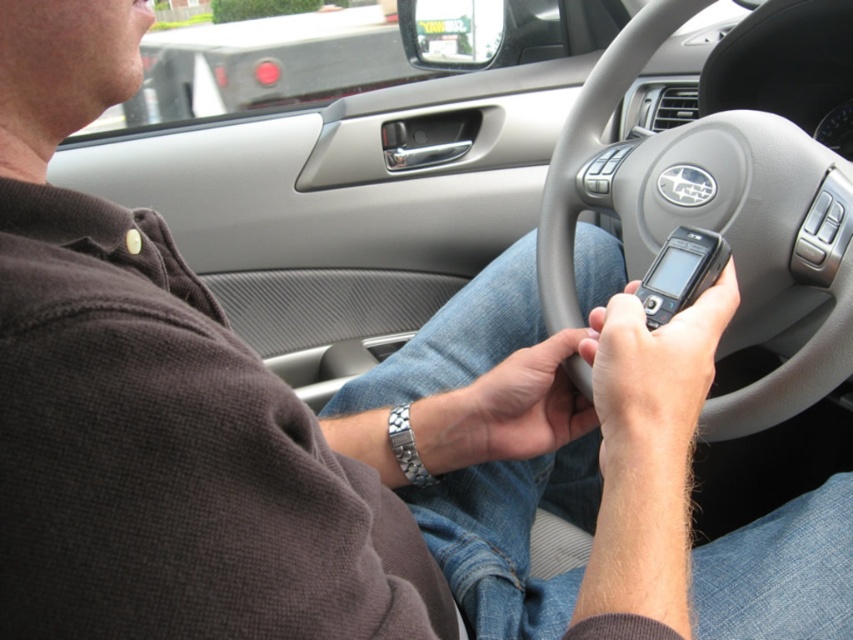
Does black matte phone at center appear over black plastic phone at center?

No.

Is black matte phone at center thinner than black plastic phone at center?

Incorrect, black matte phone at center's width is not less than black plastic phone at center's.

Between point (664, 440) and point (679, 304), which one is positioned in front?

Point (664, 440) is in front.

Where is `black matte phone at center`? black matte phone at center is located at coordinates (654, 369).

Does gray matte steering wheel at center appear under black plastic phone at center?

Actually, gray matte steering wheel at center is above black plastic phone at center.

Does gray matte steering wheel at center lie behind black plastic phone at center?

Yes, it is behind black plastic phone at center.

Where is `gray matte steering wheel at center`? This screenshot has width=853, height=640. gray matte steering wheel at center is located at coordinates (711, 221).

The height and width of the screenshot is (640, 853). What are the coordinates of `gray matte steering wheel at center` in the screenshot? It's located at (711, 221).

Which is more to the left, gray matte steering wheel at center or black matte phone at center?

Positioned to the left is black matte phone at center.

Is point (718, 150) positioned behind point (727, 269)?

Yes, point (718, 150) is farther from viewer.

Which is in front, point (811, 348) or point (583, 340)?

Positioned in front is point (811, 348).

In order to click on gray matte steering wheel at center in this screenshot , I will do `click(711, 221)`.